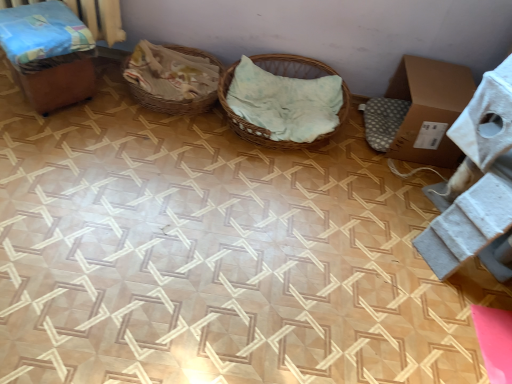
Question: From a real-world perspective, is woven wood basket at center, positioned as the 1th basket in right-to-left order, positioned above or below brown cardboard box at right?

Choices:
 (A) above
 (B) below

Answer: (B)

Question: From the image's perspective, is woven wood basket at center, positioned as the 1th basket in right-to-left order, positioned above or below brown cardboard box at right?

Choices:
 (A) above
 (B) below

Answer: (A)

Question: Estimate the real-world distances between objects in this image. Which object is farther from the brown cardboard box at right?

Choices:
 (A) wooden box at left
 (B) woven brown basket at center, which ranks as the first basket in left-to-right order
 (C) woven wood basket at center, the second basket viewed from the left

Answer: (A)

Question: Which object is positioned farthest from the brown cardboard box at right?

Choices:
 (A) woven brown basket at center, which ranks as the first basket in left-to-right order
 (B) wooden box at left
 (C) woven wood basket at center, the second basket viewed from the left

Answer: (B)